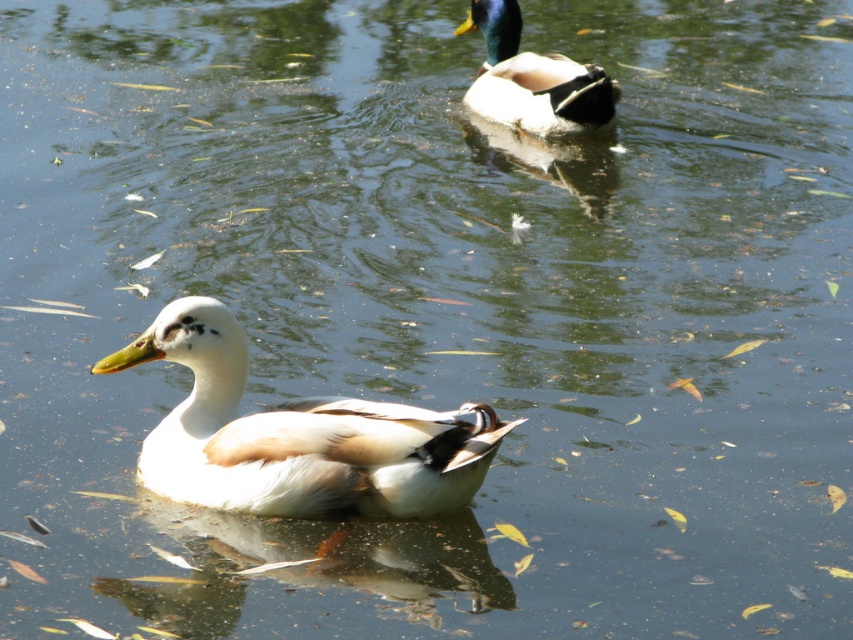
You are a wildlife photographer aiming to capture the white matte duck at center in your shot. Given that your camera frame is centered at coordinates point 0.5, 0.5, will the duck be within the frame?

The white matte duck at center is located at point (296, 435), which is slightly to the right and above the camera frame center at (426, 320). Therefore, the duck is within the frame but not exactly centered.

You are a photographer trying to capture both the white matte duck at center and the shiny green and brown duck at upper center in a single shot. Based on their sizes in the image, which duck would appear smaller in the final photo?

The white matte duck at center appears smaller in the final photo because it occupies less space compared to the shiny green and brown duck at upper center.

You are a photographer trying to capture both the white matte duck at center and the shiny green and brown duck at upper center in a single shot. Based on their positions, which duck is closer to the camera?

The white matte duck at center is closer to the camera because it is positioned at the center and the shiny green and brown duck at upper center is further away.